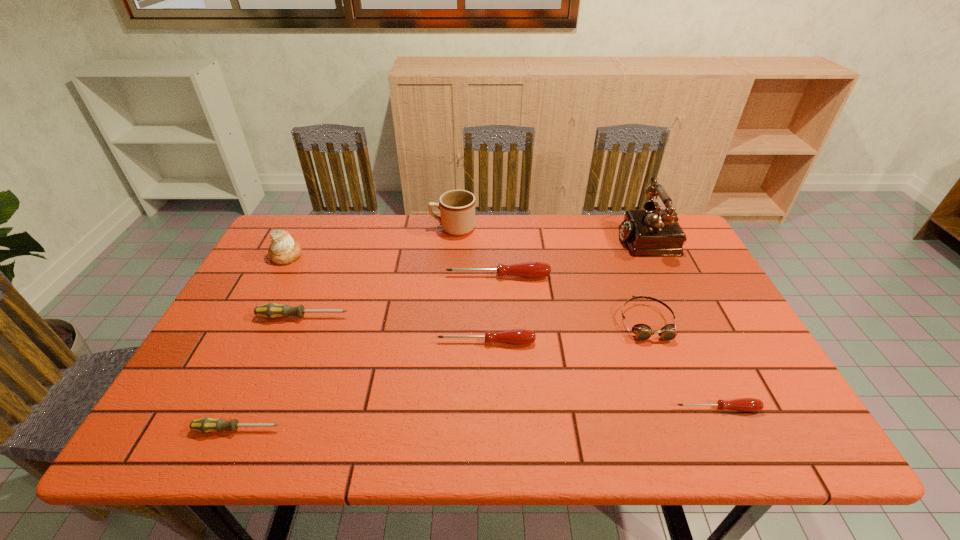
Where is `free spot between the brown mug and the rightmost screwdriver`? Image resolution: width=960 pixels, height=540 pixels. free spot between the brown mug and the rightmost screwdriver is located at coordinates (586, 318).

The height and width of the screenshot is (540, 960). I want to click on free space between the farther gray screwdriver and the farthest red screwdriver, so click(400, 296).

The width and height of the screenshot is (960, 540). Identify the location of free space between the nearest screwdriver and the farther gray screwdriver. (271, 373).

The height and width of the screenshot is (540, 960). Identify the location of free space between the brown telephone and the goggles. pyautogui.click(x=649, y=280).

You are a GUI agent. You are given a task and a screenshot of the screen. Output one action in this format:
    pyautogui.click(x=<x>, y=<y>)
    Task: Click on the vacant space that is in between the rightmost red screwdriver and the mug
    The image size is (960, 540).
    Given the screenshot: What is the action you would take?
    pyautogui.click(x=586, y=318)

What are the coordinates of `vacant space that is in between the mug and the smaller gray screwdriver` in the screenshot? It's located at pos(346,329).

Image resolution: width=960 pixels, height=540 pixels. In order to click on object that is the fifth closest to the fourth farthest object in this screenshot , I will do `click(271, 310)`.

Locate an element on the screen. The width and height of the screenshot is (960, 540). the fifth closest object to the pastry is located at coordinates (518, 336).

Locate which screwdriver ranks in proximity to the brown telephone. Please provide its 2D coordinates. Your answer should be formatted as a tuple, i.e. [(x, y)], where the tuple contains the x and y coordinates of a point satisfying the conditions above.

[(529, 269)]

Select which screwdriver appears as the second closest to the seventh shortest object. Please provide its 2D coordinates. Your answer should be formatted as a tuple, i.e. [(x, y)], where the tuple contains the x and y coordinates of a point satisfying the conditions above.

[(529, 269)]